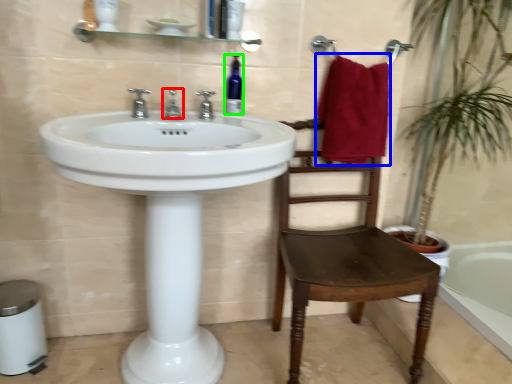
Question: Estimate the real-world distances between objects in this image. Which object is farther from tap (highlighted by a red box), bath towel (highlighted by a blue box) or bottle (highlighted by a green box)?

Choices:
 (A) bath towel
 (B) bottle

Answer: (A)